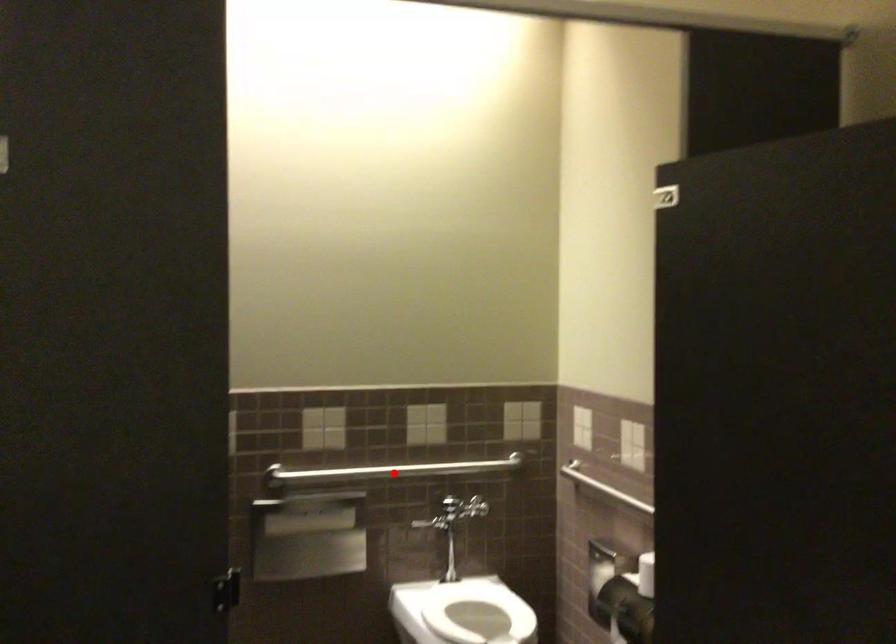
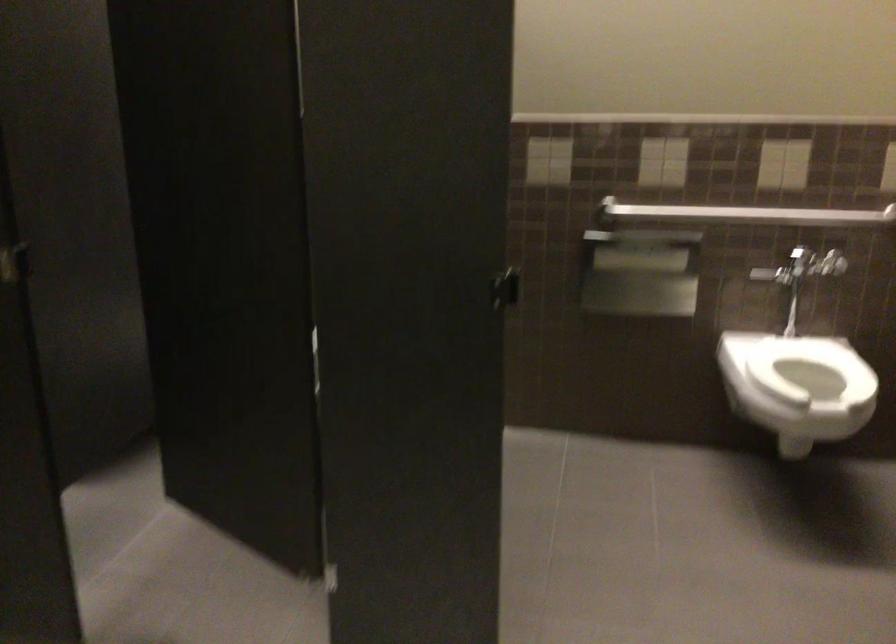
Locate, in the second image, the point that corresponds to the highlighted location in the first image.

(745, 214)